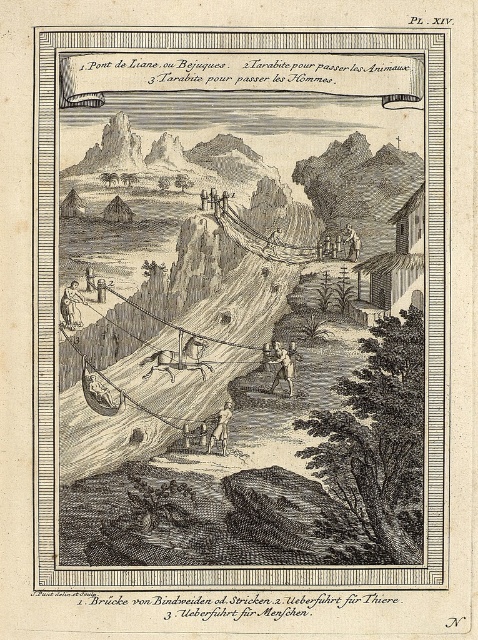
How much distance is there between light brown wood figure at lower left and brown leather figure at lower center?

light brown wood figure at lower left and brown leather figure at lower center are 34.26 inches apart from each other.

Which is in front, point (63, 321) or point (275, 378)?

Point (63, 321) is in front.

Find the location of a particular element. The height and width of the screenshot is (640, 478). light brown wood figure at lower left is located at coordinates (72, 305).

Identify the location of wire rope bridge at center. (240, 307).

Does point (315, 396) lie behind point (226, 404)?

Yes, it is.

The width and height of the screenshot is (478, 640). Find the location of `wire rope bridge at center`. wire rope bridge at center is located at coordinates [240, 307].

Who is lower down, wire rope bridge at center or brown leather figure at lower center?

Positioned lower is brown leather figure at lower center.

From the picture: Can you confirm if wire rope bridge at center is shorter than brown leather figure at lower center?

In fact, wire rope bridge at center may be taller than brown leather figure at lower center.

You are a GUI agent. You are given a task and a screenshot of the screen. Output one action in this format:
    pyautogui.click(x=<x>, y=<y>)
    Task: Click on the wire rope bridge at center
    Image resolution: width=478 pixels, height=640 pixels.
    Given the screenshot: What is the action you would take?
    pyautogui.click(x=240, y=307)

Find the location of a particular element. wire rope bridge at center is located at coordinates (240, 307).